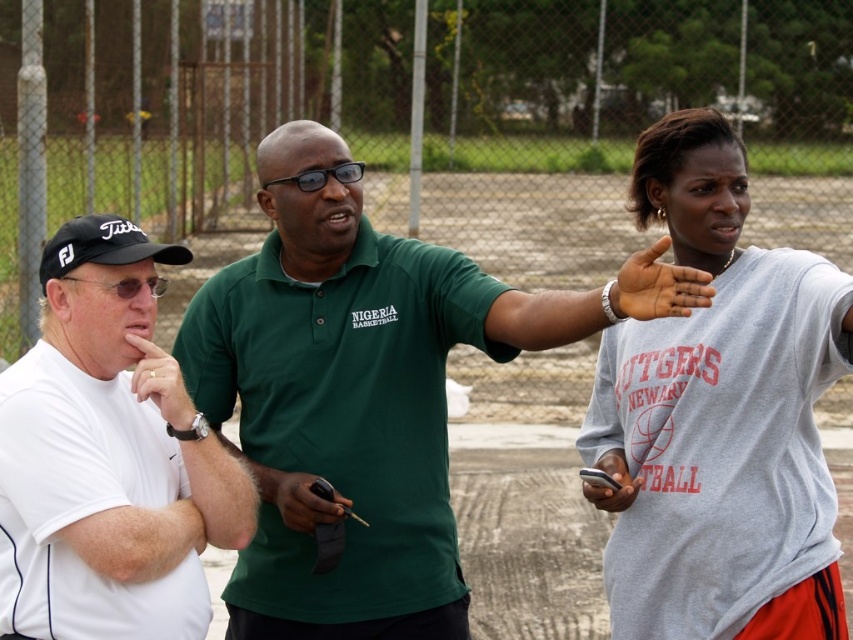
You are standing at the origin point of the coordinate system. You see a point marked at coordinate (351, 394). What object is located at that point?

The point at coordinate (351, 394) indicates the green matte polo shirt at center.

You are standing at point (659, 312) and want to walk to point (787, 636). Which direction should you move in relation to the chain link fence in the background?

You should move towards the chain link fence in the background because point (787, 636) is behind point (659, 312) relative to the fence.

You are a photographer trying to capture a group photo of the gray cotton shirt at upper right and the dark skin palm at center. If you want to ensure both subjects are fully visible in the frame, which subject requires more space horizontally?

The gray cotton shirt at upper right requires more space horizontally because its width is larger than the dark skin palm at center.